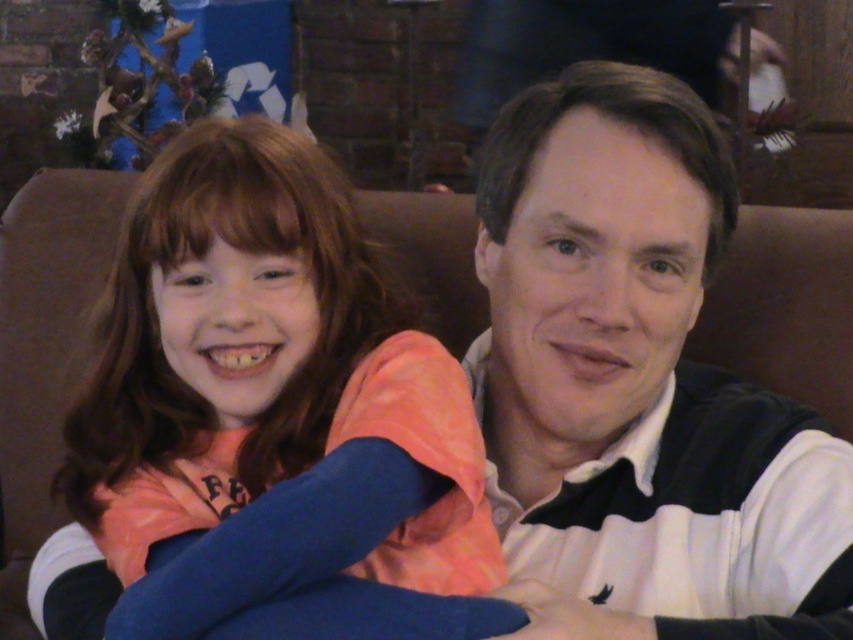
Is orange fleece sweater at left positioned behind white striped sweater at center?

No, orange fleece sweater at left is in front of white striped sweater at center.

Can you confirm if orange fleece sweater at left is smaller than white striped sweater at center?

Actually, orange fleece sweater at left might be larger than white striped sweater at center.

I want to click on orange fleece sweater at left, so [273, 417].